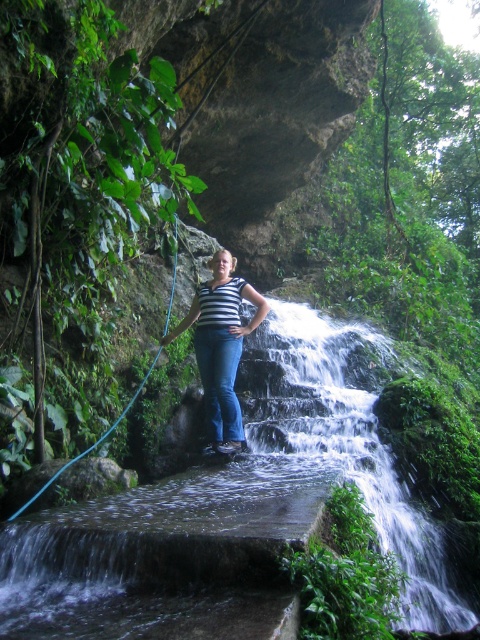
You are a photographer trying to capture the white frothy water at center and the blue rubber hose at center in the same frame. Which object will appear closer to the camera in the photo?

The white frothy water at center is in front of the blue rubber hose at center, so it will appear closer to the camera in the photo.

You are a hiker who wants to cross the stone bridge but need to avoid getting wet. The white frothy water at center and blue rubber hose at center are in your path. Which object should you step over to stay dry?

You should step over the blue rubber hose at center because the white frothy water at center is shorter than the blue rubber hose at center, meaning the water is lower and less likely to splash onto you.